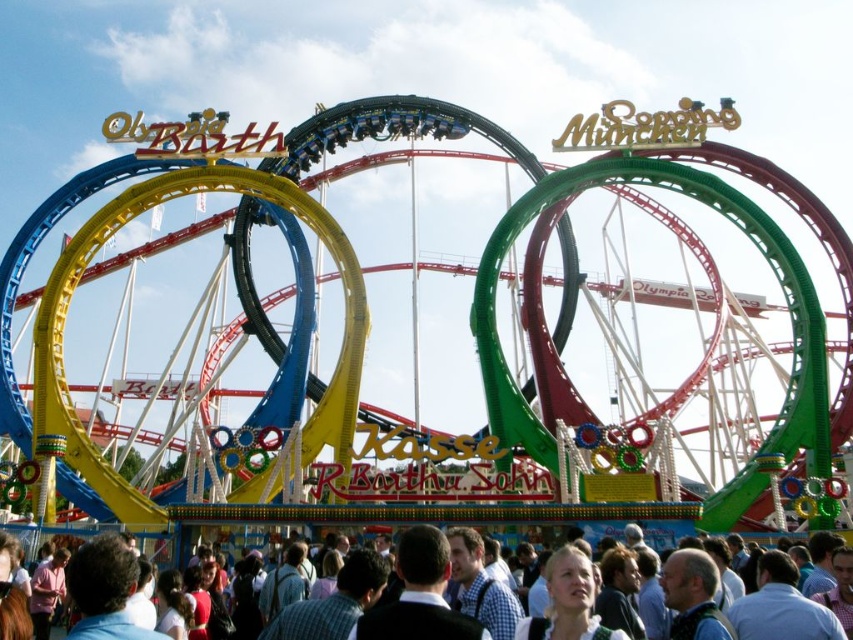
You are standing at the fairground and want to take a photo of the metallic roller coaster at center without any people in the frame. Is there a way to position yourself so that the matte white crowd at lower center does not block your view of the roller coaster?

Yes, since the metallic roller coaster at center is located above the matte white crowd at lower center, you can position yourself higher or angle your camera upwards to capture the roller coaster without the crowd blocking the view.

What is the spatial relationship between the metallic roller coaster at center and the matte white crowd at lower center?

The metallic roller coaster at center is closer to the viewer than the matte white crowd at lower center.